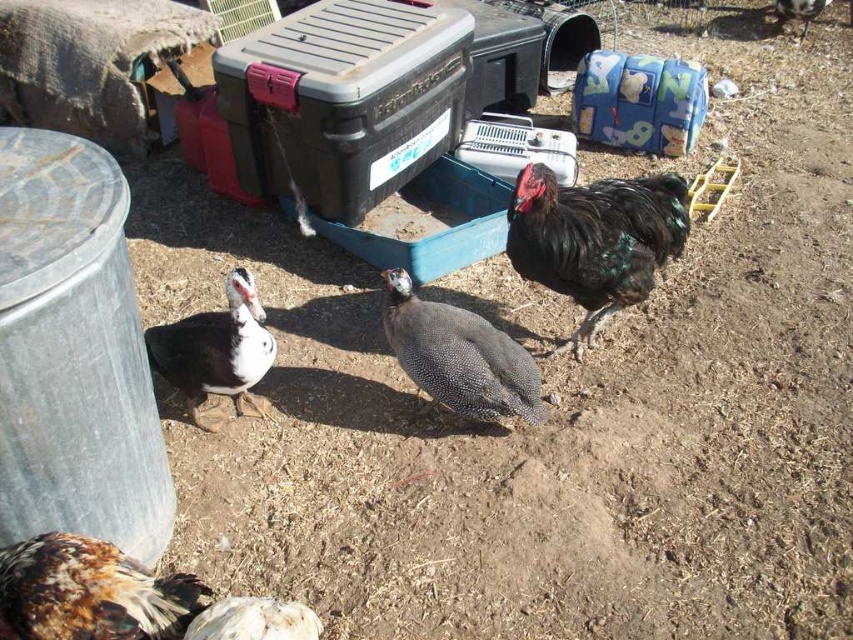
Question: Does speckled feathered chicken at lower left have a greater width compared to speckled feathered guinea fowl at center?

Choices:
 (A) yes
 (B) no

Answer: (B)

Question: Which object is farther from the camera taking this photo?

Choices:
 (A) speckled feathered guinea fowl at center
 (B) dark brown feathers at center
 (C) speckled feathered chicken at lower left

Answer: (A)

Question: Can you confirm if shiny black rooster at right is positioned to the right of speckled feathered chicken at lower left?

Choices:
 (A) yes
 (B) no

Answer: (A)

Question: Among these objects, which one is nearest to the camera?

Choices:
 (A) dark brown feathers at center
 (B) speckled feathered guinea fowl at center

Answer: (A)

Question: Which object is positioned closest to the dark brown feathers at center?

Choices:
 (A) speckled feathered chicken at lower left
 (B) speckled feathered guinea fowl at center
 (C) shiny black rooster at right

Answer: (B)

Question: Does shiny black rooster at right come in front of speckled feathered chicken at lower left?

Choices:
 (A) no
 (B) yes

Answer: (A)